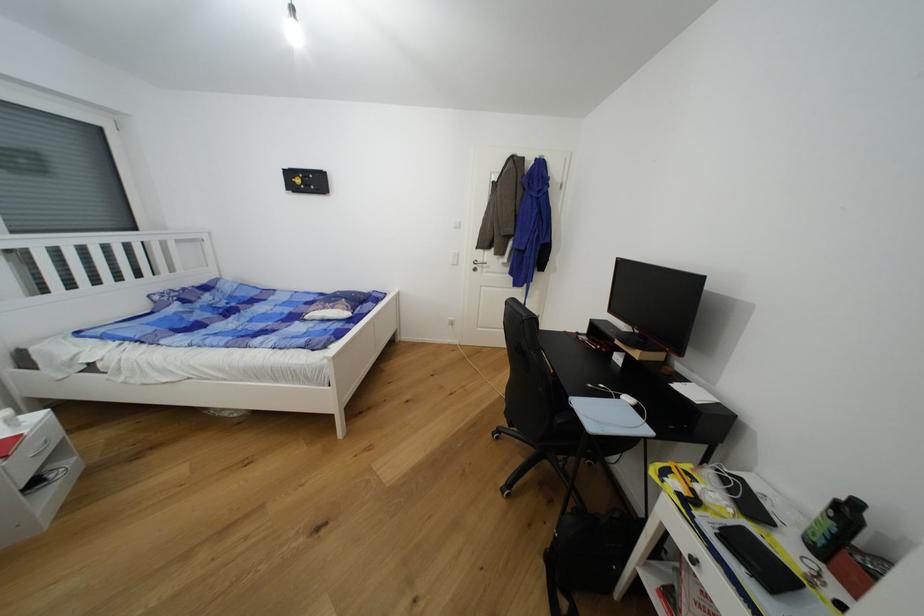
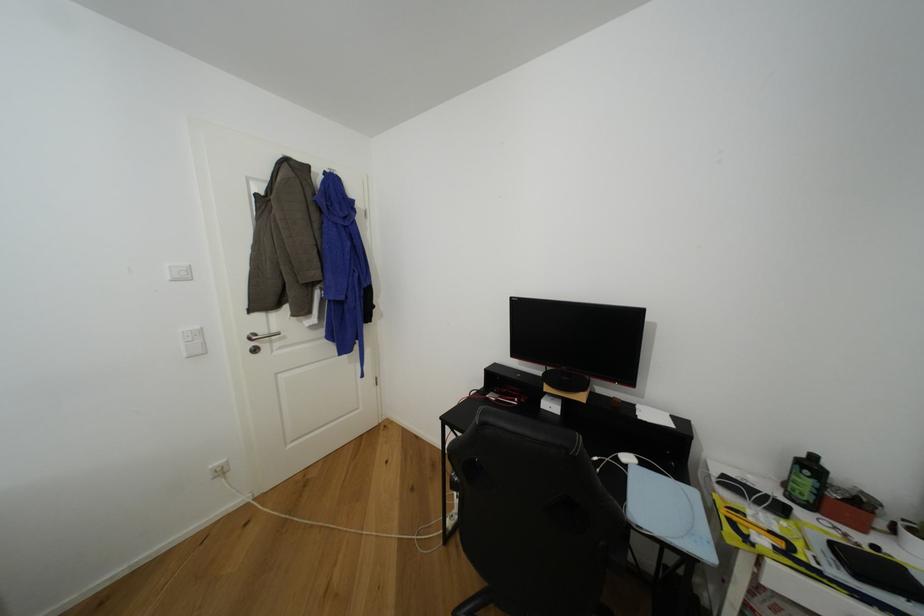
In the second image, find the point that corresponds to [484,262] in the first image.

(268, 334)